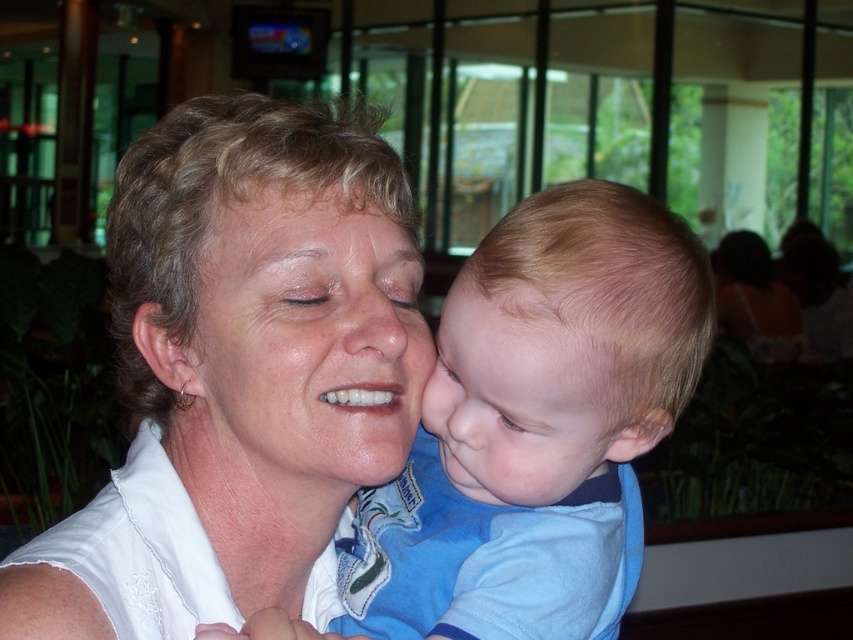
You are a photographer trying to capture a closeup shot of the smooth skin face at center. The camera you are using has a minimum focusing distance of 24 inches. Will you be able to take the photo without moving closer?

The distance between the smooth skin face at center and the camera is 23.80 inches, which is slightly less than the camera minimum focusing distance of 24 inches. Therefore, you will need to move back slightly to ensure the camera can focus properly.

You are taking a photo of two people in a restaurant. There are two points marked in the image at coordinates point (541, 417) and point (448, 436). Which point is closer to the camera?

Point (541, 417) is closer to the camera than point (448, 436).

Based on the scene description, where is the smooth skin face at center positioned in the image?

The smooth skin face at center is located at point (302,346).